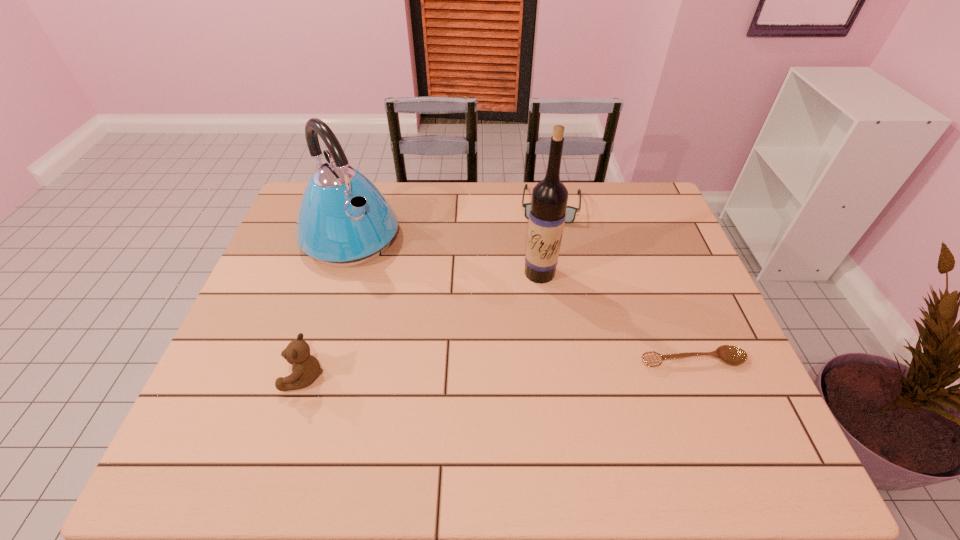
This screenshot has height=540, width=960. I want to click on empty location between the kettle and the rightmost object, so click(x=521, y=299).

Image resolution: width=960 pixels, height=540 pixels. I want to click on free space between the shortest object and the wine bottle, so click(x=616, y=316).

Find the location of a particular element. the third closest object to the third shortest object is located at coordinates (571, 211).

Identify the location of the fourth closest object to the wine bottle. This screenshot has height=540, width=960. (306, 368).

Where is `vacant space that satisfies the following two spatial constraints: 1. on the back side of the fourth shortest object; 2. on the right side of the fourth tallest object`? This screenshot has width=960, height=540. vacant space that satisfies the following two spatial constraints: 1. on the back side of the fourth shortest object; 2. on the right side of the fourth tallest object is located at coordinates (361, 205).

This screenshot has height=540, width=960. Identify the location of free space that satisfies the following two spatial constraints: 1. on the front side of the wine bottle; 2. on the left side of the kettle. (340, 273).

At what (x,y) coordinates should I click in order to perform the action: click on free space that satisfies the following two spatial constraints: 1. on the front side of the second tallest object; 2. on the right side of the rightmost object. Please return your answer as a coordinate pair (x, y). This screenshot has height=540, width=960. Looking at the image, I should click on (313, 360).

Where is `vacant space that satisfies the following two spatial constraints: 1. on the front side of the wine bottle; 2. on the right side of the fourth shortest object`? vacant space that satisfies the following two spatial constraints: 1. on the front side of the wine bottle; 2. on the right side of the fourth shortest object is located at coordinates (340, 273).